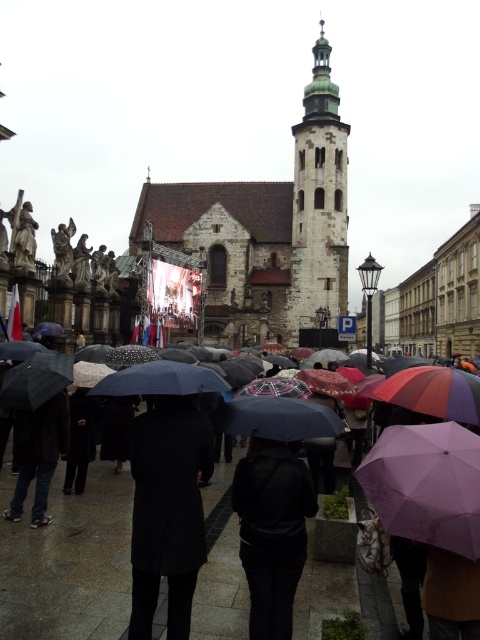
You are standing in the town square and want to stay dry while watching the live event on the large screen. You have a matte black umbrella at center and a black leather jacket at center. Which item would provide better coverage against the rain?

The matte black umbrella at center has a larger size compared to the black leather jacket at center, so it would provide better coverage against the rain.

You are a tourist visiting the town square and want to take a photo of the white stone tower at center without any people blocking it. Since the black leather jacket at center is in the way, can you estimate whether the tower is large enough to still be visible behind the person wearing the jacket?

The white stone tower at center is bigger than the black leather jacket at center, so it should still be visible behind the person wearing the jacket.

You are standing in the town square and want to take a photo of the purple matte umbrella at center without the white stone tower at center appearing in the frame. Which direction should you move to achieve this?

Move to the right of the purple matte umbrella at center so the white stone tower at center is no longer in the frame.